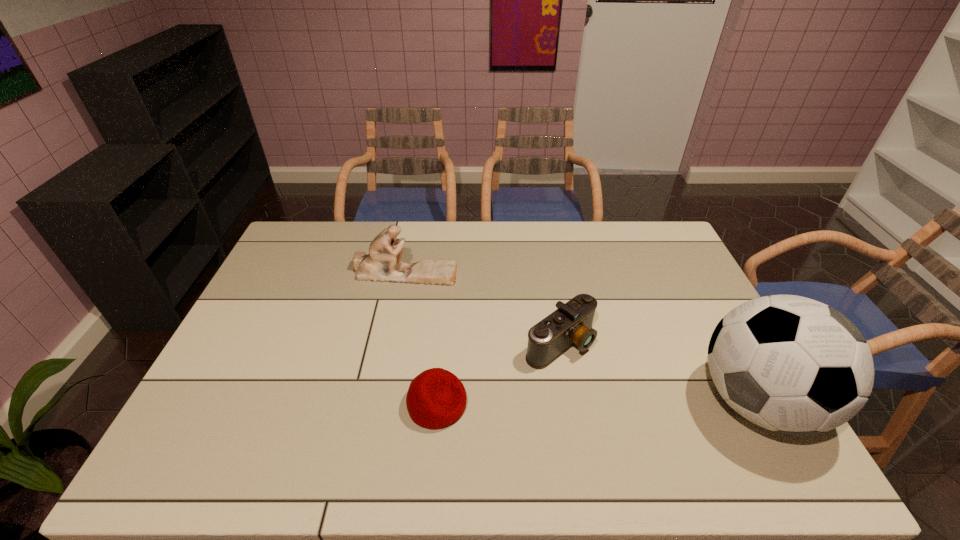
Where is `free region located on the front-facing side of the figurine`? The image size is (960, 540). free region located on the front-facing side of the figurine is located at coordinates (458, 300).

Find the location of a particular element. The height and width of the screenshot is (540, 960). vacant space situated 0.080m on the lens of the second object from right to left is located at coordinates (612, 381).

The image size is (960, 540). Find the location of `vacant space situated 0.270m on the lens of the second object from right to left`. vacant space situated 0.270m on the lens of the second object from right to left is located at coordinates (677, 429).

I want to click on free point located 0.150m on the lens of the second object from right to left, so click(x=635, y=397).

Locate an element on the screen. The width and height of the screenshot is (960, 540). beanbag located in the near edge section of the desktop is located at coordinates (436, 398).

Find the location of `soccer ball located in the near edge section of the desktop`. soccer ball located in the near edge section of the desktop is located at coordinates point(790,364).

The image size is (960, 540). I want to click on object located at the right edge, so click(x=790, y=364).

The height and width of the screenshot is (540, 960). Find the location of `object located at the near right corner`. object located at the near right corner is located at coordinates (790, 364).

Find the location of a particular element. free space at the far edge of the desktop is located at coordinates (410, 227).

Where is `free space at the near edge`? free space at the near edge is located at coordinates (279, 414).